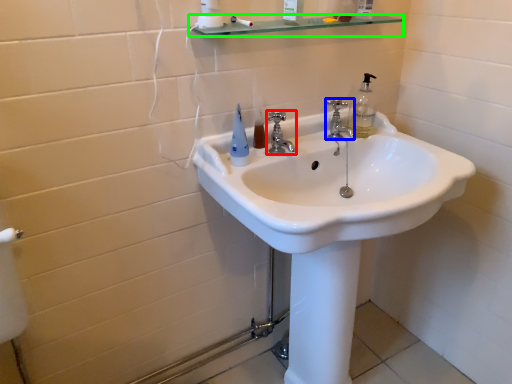
Question: Estimate the real-world distances between objects in this image. Which object is farther from tap (highlighted by a red box), tap (highlighted by a blue box) or balustrade (highlighted by a green box)?

Choices:
 (A) tap
 (B) balustrade

Answer: (B)